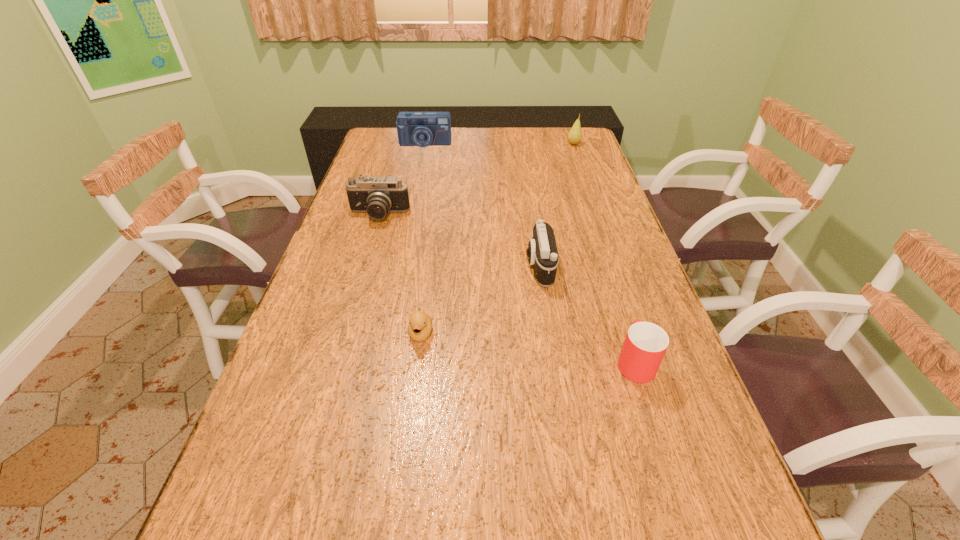
Where is `free space located 0.290m on the front lens of the fourth farthest object`? The image size is (960, 540). free space located 0.290m on the front lens of the fourth farthest object is located at coordinates (417, 266).

Where is `vacant position located 0.140m on the front lens of the fourth farthest object`? The height and width of the screenshot is (540, 960). vacant position located 0.140m on the front lens of the fourth farthest object is located at coordinates (472, 266).

Locate an element on the screen. This screenshot has height=540, width=960. free space located on the front lens of the fourth farthest object is located at coordinates (484, 266).

Locate an element on the screen. vacant space situated 0.370m on the side of the cup with the handle is located at coordinates (596, 242).

At what (x,y) coordinates should I click in order to perform the action: click on free point located on the side of the cup with the handle. Please return your answer as a coordinate pair (x, y). Looking at the image, I should click on (612, 289).

Identify the location of free space located on the side of the cup with the handle. (598, 248).

Where is `vacant space located 0.200m facing forward on the shortest object`? vacant space located 0.200m facing forward on the shortest object is located at coordinates (408, 430).

You are a GUI agent. You are given a task and a screenshot of the screen. Output one action in this format:
    pyautogui.click(x=<x>, y=<y>)
    Task: Click on the camera that is at the far edge
    
    Given the screenshot: What is the action you would take?
    pyautogui.click(x=422, y=129)

The image size is (960, 540). I want to click on pear that is at the far edge, so click(x=574, y=136).

Image resolution: width=960 pixels, height=540 pixels. In order to click on pear located in the right edge section of the desktop in this screenshot , I will do `click(574, 136)`.